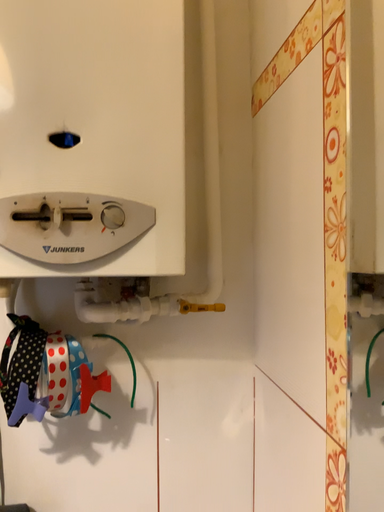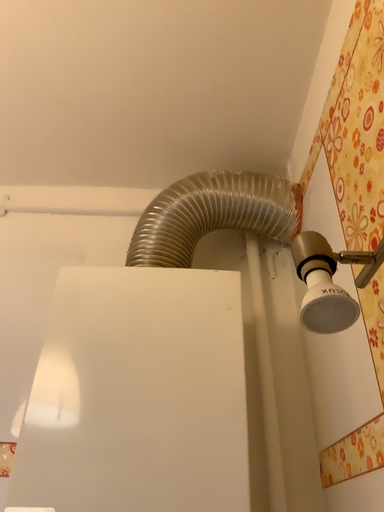
Question: How did the camera likely rotate when shooting the video?

Choices:
 (A) rotated downward
 (B) rotated upward

Answer: (B)